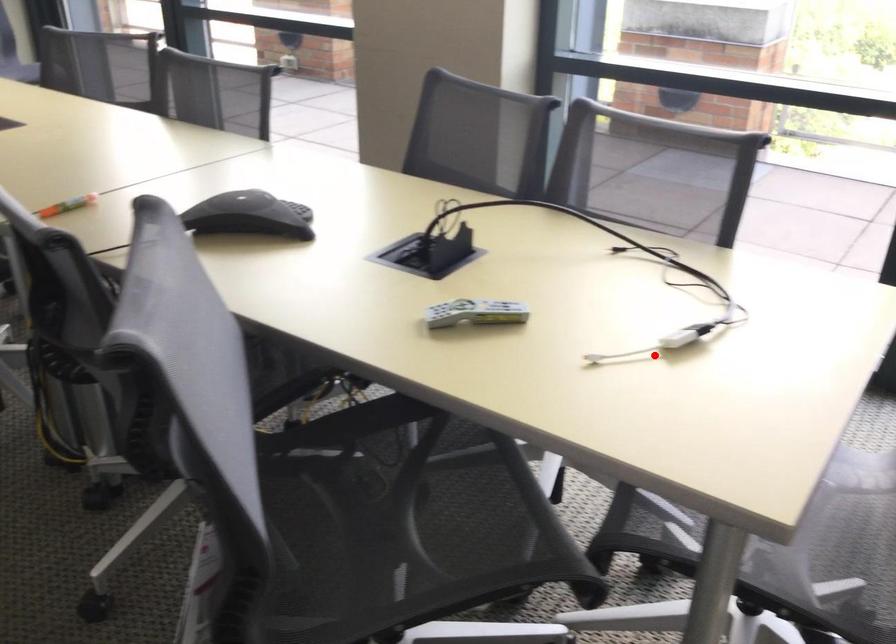
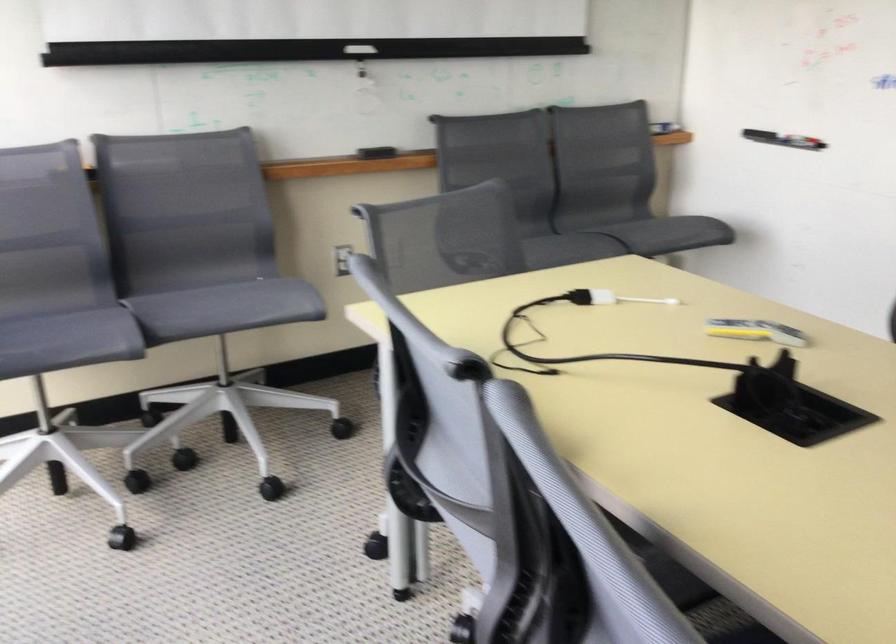
Question: I am providing you with two images of the same scene from different viewpoints. A red point is shown in image1. For the corresponding object point in image2, is it positioned nearer or farther from the camera?

Choices:
 (A) Nearer
 (B) Farther

Answer: (B)